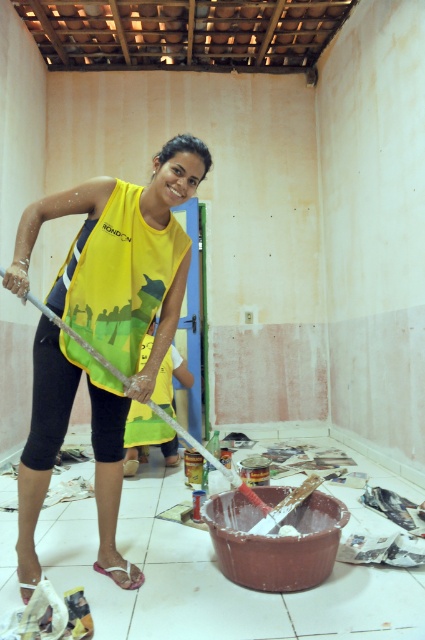
You are a painter standing 1.6 meters tall. You want to reach the yellow fabric at center to touch it. Can you reach it without any tools?

The yellow fabric at center is 1.78 meters away from the camera, so if you are standing at the camera position, you cannot reach it with your height of 1.6 meters without any tools.

You are a painter standing at point A with coordinates point A at (102, 275). You need to reach point B which is 2.05 meters away. Is there enough space to move freely between these two points without obstacles?

The distance between point A at (102, 275) and point B is 2.05 meters, so there is enough space to move freely between these two points without obstacles.

You are an interior designer who needs to place a new decorative item in the room. Considering the yellow fabric at center and the white plastic shovel at center, which object should you avoid placing something near because it takes up more space?

The white plastic shovel at center takes up more space than the yellow fabric at center, so you should avoid placing something near the white plastic shovel at center.